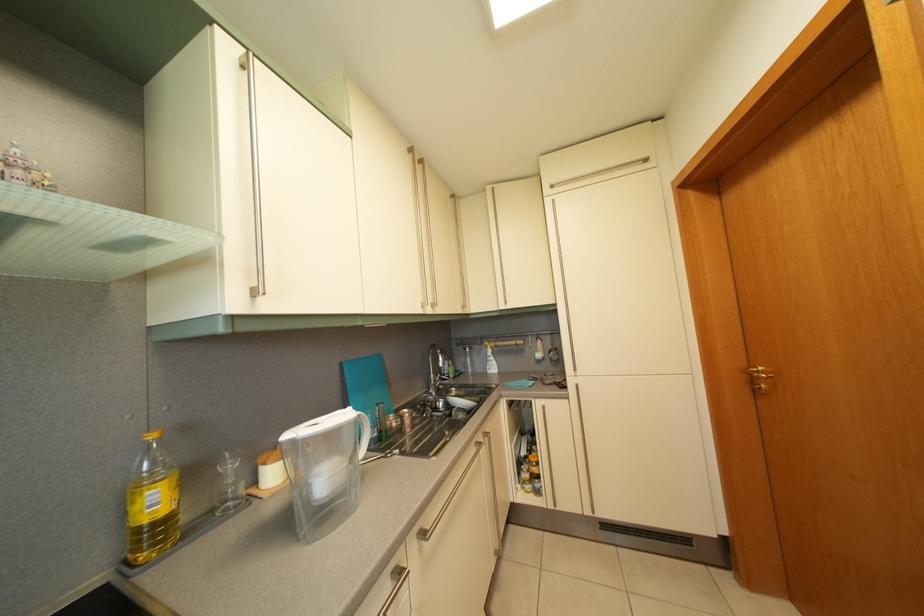
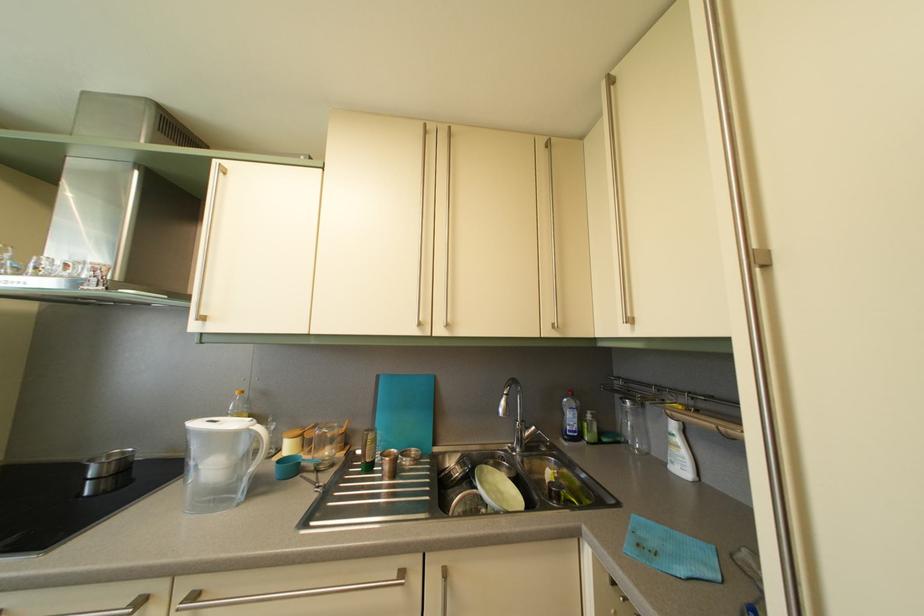
Find the pixel in the second image that matches (x=500, y=365) in the first image.

(687, 448)